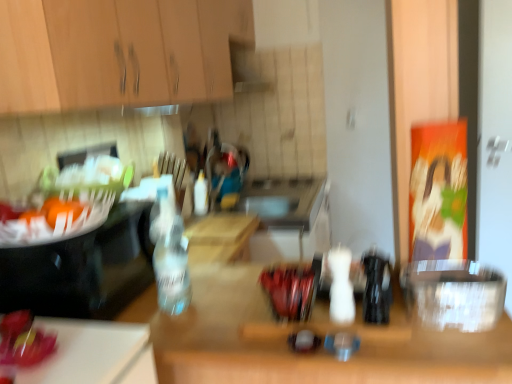
You are a GUI agent. You are given a task and a screenshot of the screen. Output one action in this format:
    pyautogui.click(x=<x>, y=<y>)
    Task: Click on the empty space that is to the right of black plastic bottle at center, which ranks as the first bottle in right-to-left order
    The width and height of the screenshot is (512, 384).
    Given the screenshot: What is the action you would take?
    pyautogui.click(x=430, y=316)